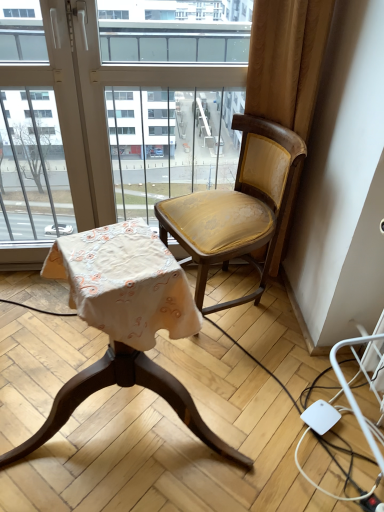
How much space does matte gold fabric chair at right, the second chair when ordered from left to right, occupy vertically?

The height of matte gold fabric chair at right, the second chair when ordered from left to right, is 31.00 inches.

Where is `transparent glass window at upper center`? transparent glass window at upper center is located at coordinates (97, 98).

You are a GUI agent. You are given a task and a screenshot of the screen. Output one action in this format:
    pyautogui.click(x=<x>, y=<y>)
    Task: Click on the matte gold fabric chair at right, the second chair when ordered from left to right
    This screenshot has width=384, height=512.
    Given the screenshot: What is the action you would take?
    pyautogui.click(x=237, y=207)

Is matte gold fabric chair at center, the 2th chair when ordered from right to left, positioned behind matte gold fabric chair at right, which is the 1th chair in right-to-left order?

No, it is in front of matte gold fabric chair at right, which is the 1th chair in right-to-left order.

Is matte gold fabric chair at center, the 2th chair when ordered from right to left, to the left of matte gold fabric chair at right, which is the 1th chair in right-to-left order, from the viewer's perspective?

Yes, matte gold fabric chair at center, the 2th chair when ordered from right to left, is to the left of matte gold fabric chair at right, which is the 1th chair in right-to-left order.

How many degrees apart are the facing directions of matte gold fabric chair at center, the 2th chair when ordered from right to left, and matte gold fabric chair at right, the second chair when ordered from left to right?

There is a 81.1-degree angle between the facing directions of matte gold fabric chair at center, the 2th chair when ordered from right to left, and matte gold fabric chair at right, the second chair when ordered from left to right.

Are matte gold fabric chair at center, placed as the 1th chair when sorted from left to right, and matte gold fabric chair at right, which is the 1th chair in right-to-left order, beside each other?

matte gold fabric chair at center, placed as the 1th chair when sorted from left to right, and matte gold fabric chair at right, which is the 1th chair in right-to-left order, are clearly separated.

What's the angular difference between transparent glass window at upper center and matte gold fabric chair at right, which is the 1th chair in right-to-left order,'s facing directions?

They differ by 60 degrees in their facing directions.

Considering the sizes of objects transparent glass window at upper center and matte gold fabric chair at right, the second chair when ordered from left to right, in the image provided, who is bigger, transparent glass window at upper center or matte gold fabric chair at right, the second chair when ordered from left to right,?

matte gold fabric chair at right, the second chair when ordered from left to right, is bigger.

From a real-world perspective, relative to matte gold fabric chair at right, the second chair when ordered from left to right, is transparent glass window at upper center vertically above or below?

In terms of real-world spatial position, transparent glass window at upper center is above matte gold fabric chair at right, the second chair when ordered from left to right.

Which object is positioned more to the right, transparent glass window at upper center or matte gold fabric chair at right, which is the 1th chair in right-to-left order?

From the viewer's perspective, matte gold fabric chair at right, which is the 1th chair in right-to-left order, appears more on the right side.

Considering the relative positions of matte gold fabric chair at right, the second chair when ordered from left to right, and transparent glass window at upper center in the image provided, is matte gold fabric chair at right, the second chair when ordered from left to right, to the right of transparent glass window at upper center from the viewer's perspective?

Indeed, matte gold fabric chair at right, the second chair when ordered from left to right, is positioned on the right side of transparent glass window at upper center.

Is matte gold fabric chair at right, the second chair when ordered from left to right, with transparent glass window at upper center?

No.

Is point (251, 136) farther from viewer compared to point (77, 112)?

Yes, point (251, 136) is farther from viewer.

This screenshot has width=384, height=512. I want to click on window behind the matte gold fabric chair at right, which is the 1th chair in right-to-left order, so click(97, 98).

The image size is (384, 512). I want to click on window behind the matte gold fabric chair at center, the 2th chair when ordered from right to left, so click(x=97, y=98).

From a real-world perspective, who is located higher, matte gold fabric chair at center, placed as the 1th chair when sorted from left to right, or transparent glass window at upper center?

In real-world perspective, transparent glass window at upper center is above.

Which is more to the left, matte gold fabric chair at center, placed as the 1th chair when sorted from left to right, or transparent glass window at upper center?

From the viewer's perspective, transparent glass window at upper center appears more on the left side.

Which is correct: matte gold fabric chair at right, the second chair when ordered from left to right, is inside matte gold fabric chair at center, the 2th chair when ordered from right to left, or outside of it?

matte gold fabric chair at right, the second chair when ordered from left to right, cannot be found inside matte gold fabric chair at center, the 2th chair when ordered from right to left.

Is matte gold fabric chair at right, the second chair when ordered from left to right, not close to matte gold fabric chair at center, the 2th chair when ordered from right to left?

matte gold fabric chair at right, the second chair when ordered from left to right, is actually quite close to matte gold fabric chair at center, the 2th chair when ordered from right to left.

From a real-world perspective, which object stands above the other?

matte gold fabric chair at right, which is the 1th chair in right-to-left order, from a real-world perspective.

From the image's perspective, is transparent glass window at upper center above or below matte gold fabric chair at center, the 2th chair when ordered from right to left?

transparent glass window at upper center is above matte gold fabric chair at center, the 2th chair when ordered from right to left.

Which object is closer to the camera, transparent glass window at upper center or matte gold fabric chair at center, the 2th chair when ordered from right to left?

matte gold fabric chair at center, the 2th chair when ordered from right to left, is in front.

Is transparent glass window at upper center turned away from matte gold fabric chair at center, the 2th chair when ordered from right to left?

That's right, transparent glass window at upper center is facing away from matte gold fabric chair at center, the 2th chair when ordered from right to left.

Image resolution: width=384 pixels, height=512 pixels. I want to click on chair in front of the matte gold fabric chair at right, the second chair when ordered from left to right, so click(127, 283).

Locate an element on the screen. Image resolution: width=384 pixels, height=512 pixels. the 2nd chair counting from the right side of the transparent glass window at upper center is located at coordinates (237, 207).

Estimate the real-world distances between objects in this image. Which object is closer to transparent glass window at upper center, matte gold fabric chair at right, the second chair when ordered from left to right, or matte gold fabric chair at center, the 2th chair when ordered from right to left?

The object closer to transparent glass window at upper center is matte gold fabric chair at right, the second chair when ordered from left to right.

Based on their spatial positions, is matte gold fabric chair at center, the 2th chair when ordered from right to left, or transparent glass window at upper center further from matte gold fabric chair at right, which is the 1th chair in right-to-left order?

matte gold fabric chair at center, the 2th chair when ordered from right to left, is further to matte gold fabric chair at right, which is the 1th chair in right-to-left order.

Looking at the image, which one is located closer to matte gold fabric chair at center, placed as the 1th chair when sorted from left to right, matte gold fabric chair at right, which is the 1th chair in right-to-left order, or transparent glass window at upper center?

matte gold fabric chair at right, which is the 1th chair in right-to-left order, lies closer to matte gold fabric chair at center, placed as the 1th chair when sorted from left to right, than the other object.

Estimate the real-world distances between objects in this image. Which object is closer to transparent glass window at upper center, matte gold fabric chair at center, the 2th chair when ordered from right to left, or matte gold fabric chair at right, which is the 1th chair in right-to-left order?

Based on the image, matte gold fabric chair at right, which is the 1th chair in right-to-left order, appears to be nearer to transparent glass window at upper center.

Considering their positions, is transparent glass window at upper center positioned closer to matte gold fabric chair at right, the second chair when ordered from left to right, than matte gold fabric chair at center, placed as the 1th chair when sorted from left to right?

Among the two, transparent glass window at upper center is located nearer to matte gold fabric chair at right, the second chair when ordered from left to right.

When comparing their distances from matte gold fabric chair at center, the 2th chair when ordered from right to left, does transparent glass window at upper center or matte gold fabric chair at right, which is the 1th chair in right-to-left order, seem further?

Based on the image, transparent glass window at upper center appears to be further to matte gold fabric chair at center, the 2th chair when ordered from right to left.

Locate an element on the screen. This screenshot has width=384, height=512. chair located between matte gold fabric chair at center, the 2th chair when ordered from right to left, and transparent glass window at upper center in the depth direction is located at coordinates (237, 207).